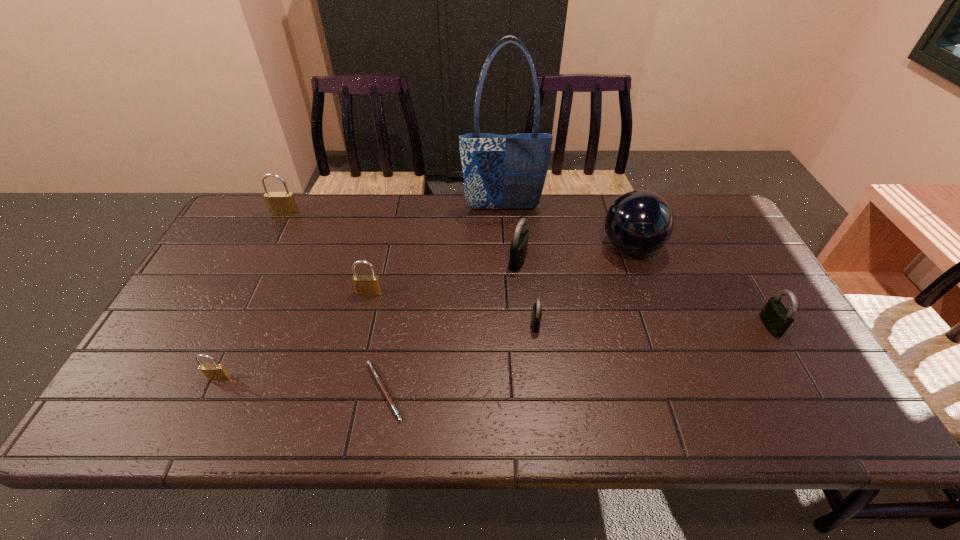
At what (x,y) coordinates should I click in order to perform the action: click on free location located 0.160m on the front-facing side of the farthest brass padlock. Please return your answer as a coordinate pair (x, y). The width and height of the screenshot is (960, 540). Looking at the image, I should click on (268, 248).

Where is `free region located on the left of the biggest black padlock`? free region located on the left of the biggest black padlock is located at coordinates (426, 261).

Image resolution: width=960 pixels, height=540 pixels. In order to click on free spot located on the left of the rightmost padlock in this screenshot , I will do `click(736, 326)`.

Image resolution: width=960 pixels, height=540 pixels. Find the location of `free space located 0.310m on the front-facing side of the seventh object from right to left`. free space located 0.310m on the front-facing side of the seventh object from right to left is located at coordinates (345, 399).

Locate an element on the screen. vacant space located on the right of the smallest black padlock is located at coordinates point(594,324).

This screenshot has height=540, width=960. Identify the location of blank space located at the nib of the pink pen. (561, 392).

Where is `shopping bag present at the far edge`? The width and height of the screenshot is (960, 540). shopping bag present at the far edge is located at coordinates (500, 171).

Find the location of a particular element. bowling ball present at the far edge is located at coordinates (639, 222).

Where is `padlock at the far edge`? This screenshot has height=540, width=960. padlock at the far edge is located at coordinates (279, 203).

This screenshot has width=960, height=540. In order to click on object at the near edge in this screenshot , I will do `click(372, 368)`.